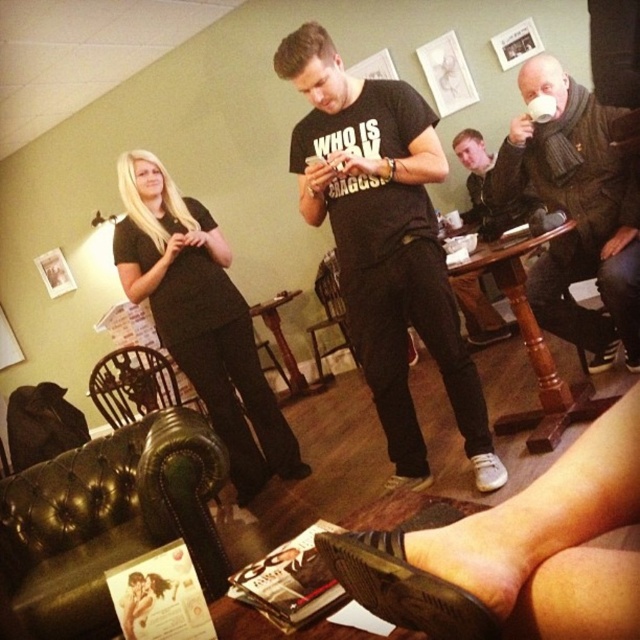
Does green leather armchair at lower left have a lesser width compared to wooden chair at lower left?

Yes.

Who is positioned more to the left, green leather armchair at lower left or wooden chair at lower left?

Positioned to the left is wooden chair at lower left.

Find the location of `green leather armchair at lower left`. green leather armchair at lower left is located at coordinates (108, 520).

Identify the location of green leather armchair at lower left. The image size is (640, 640). (108, 520).

Consider the image. Can you confirm if green leather armchair at lower left is taller than black leather armchair at center?

Incorrect, green leather armchair at lower left's height is not larger of black leather armchair at center's.

Does green leather armchair at lower left have a larger size compared to black leather armchair at center?

Correct, green leather armchair at lower left is larger in size than black leather armchair at center.

Who is more distant from viewer, (186, 508) or (332, 252)?

The point (332, 252) is behind.

You are a GUI agent. You are given a task and a screenshot of the screen. Output one action in this format:
    pyautogui.click(x=<x>, y=<y>)
    Task: Click on the green leather armchair at lower left
    The image size is (640, 640).
    Given the screenshot: What is the action you would take?
    pyautogui.click(x=108, y=520)

Where is `wooden chair at lower left`? wooden chair at lower left is located at coordinates (134, 385).

Is point (108, 417) positioned after point (536, 97)?

Yes, it is.

At what (x,y) coordinates should I click in order to perform the action: click on wooden chair at lower left. Please return your answer as a coordinate pair (x, y). Looking at the image, I should click on click(x=134, y=385).